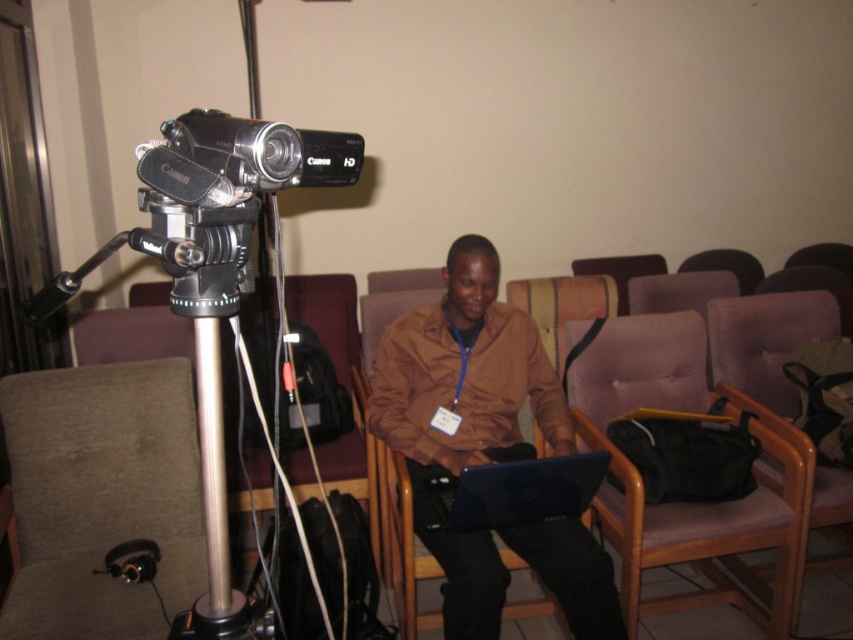
You are setting up a presentation and need to place both the blue glossy laptop at center and the silver metallic pole at center on a table. Given their sizes, which object should you place first to ensure they both fit?

The blue glossy laptop at center is larger than the silver metallic pole at center, so you should place the blue glossy laptop at center first to ensure both fit on the table.

You are organizing a small event and need to place a 12 inch wide decorative item on the table in front of the brown matte shirt at center and blue glossy laptop at center. Considering their sizes, which object should you place the item next to to ensure it doesn

The brown matte shirt at center is bigger than the blue glossy laptop at center, so placing the 12 inch wide decorative item next to the blue glossy laptop at center would leave more space for the item to fit comfortably.

You are setting up equipment for a video conference. You have a silver metallic tripod at left and a silver metallic pole at center. Which one has a greater width?

The silver metallic tripod at left has a greater width than the silver metallic pole at center.